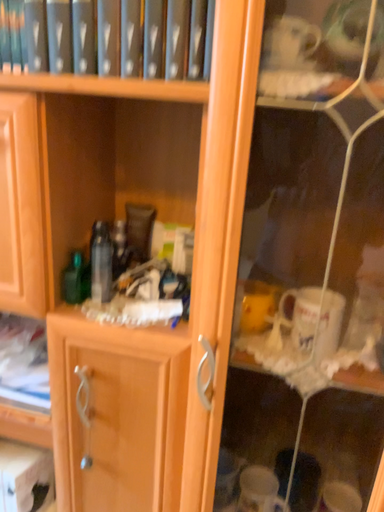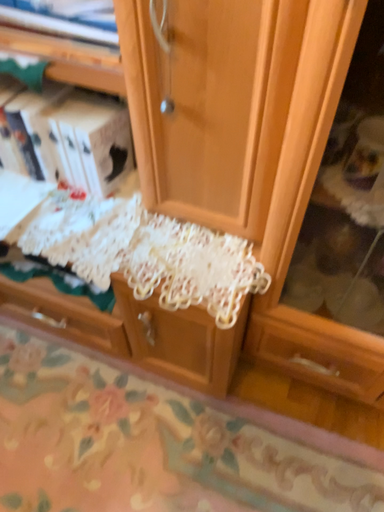
Question: Which way did the camera rotate in the video?

Choices:
 (A) rotated left
 (B) rotated right

Answer: (A)